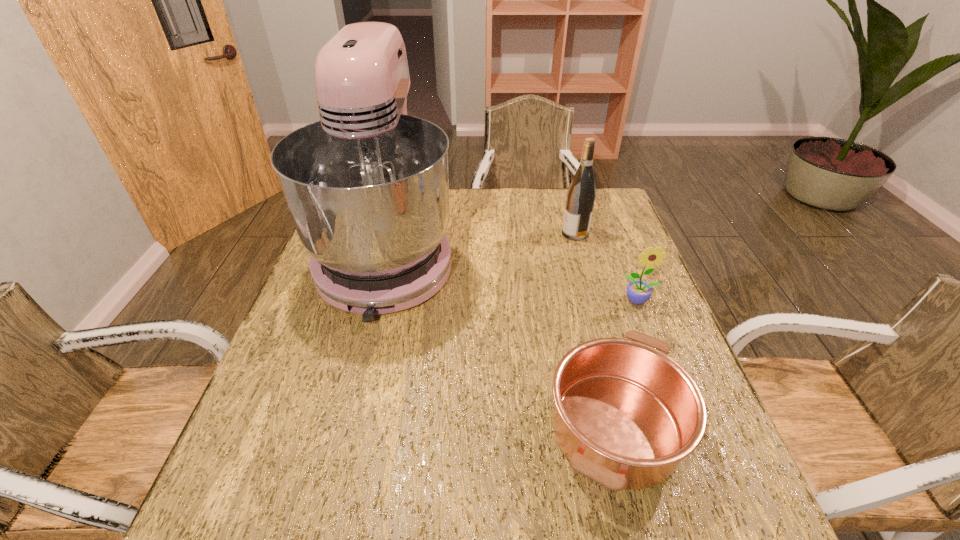
This screenshot has width=960, height=540. I want to click on free point between the wine bottle and the second shortest object, so click(x=607, y=267).

You are a GUI agent. You are given a task and a screenshot of the screen. Output one action in this format:
    pyautogui.click(x=<x>, y=<y>)
    Task: Click on the free space between the third shortest object and the second shortest object
    The image size is (960, 540).
    Given the screenshot: What is the action you would take?
    pyautogui.click(x=607, y=267)

This screenshot has height=540, width=960. In order to click on vacant area between the second shortest object and the tallest object in this screenshot , I will do `click(513, 278)`.

Where is `free area in between the wine bottle and the sunflower`? The height and width of the screenshot is (540, 960). free area in between the wine bottle and the sunflower is located at coordinates (607, 267).

Identify which object is the second closest to the nearest object. Please provide its 2D coordinates. Your answer should be formatted as a tuple, i.e. [(x, y)], where the tuple contains the x and y coordinates of a point satisfying the conditions above.

[(367, 186)]

Select which object is the second closest to the tallest object. Please provide its 2D coordinates. Your answer should be formatted as a tuple, i.e. [(x, y)], where the tuple contains the x and y coordinates of a point satisfying the conditions above.

[(581, 194)]

The image size is (960, 540). What are the coordinates of `free space that satisfies the following two spatial constraints: 1. on the back side of the third shortest object; 2. on the left side of the saucepan` in the screenshot? It's located at (566, 233).

The height and width of the screenshot is (540, 960). Identify the location of vacant space that satisfies the following two spatial constraints: 1. on the front-facing side of the nearest object; 2. on the right side of the leftmost object. (345, 428).